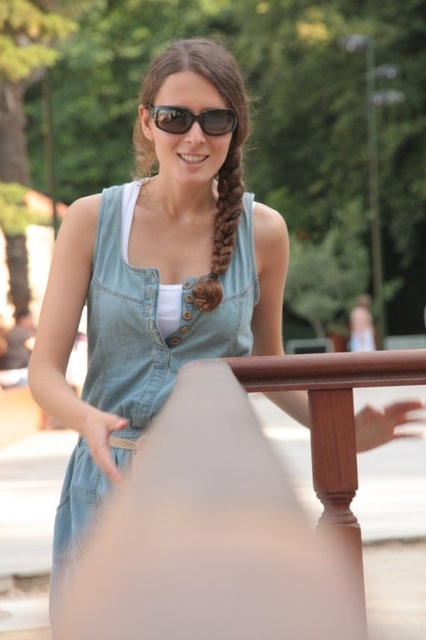
Is point (219, 259) positioned behind point (166, 120)?

Yes, point (219, 259) is farther from viewer.

Does brown silky hair braid at center lie behind matte black sunglasses at center?

Yes, brown silky hair braid at center is further from the viewer.

The width and height of the screenshot is (426, 640). Find the location of `brown silky hair braid at center`. brown silky hair braid at center is located at coordinates (222, 221).

Where is `brown silky hair braid at center`? The height and width of the screenshot is (640, 426). brown silky hair braid at center is located at coordinates (222, 221).

Can you confirm if denim dress at center is thinner than matte denim dress at center?

No, denim dress at center is not thinner than matte denim dress at center.

Is denim dress at center taller than matte denim dress at center?

Yes, denim dress at center is taller than matte denim dress at center.

Who is more forward, (101, 243) or (193, 65)?

Point (193, 65) is in front.

Where is `denim dress at center`? The width and height of the screenshot is (426, 640). denim dress at center is located at coordinates (155, 321).

Does denim dress at center have a lesser height compared to brown silky hair braid at center?

In fact, denim dress at center may be taller than brown silky hair braid at center.

Is denim dress at center positioned at the back of brown silky hair braid at center?

No.

Between point (71, 544) and point (213, 268), which one is positioned behind?

Positioned behind is point (213, 268).

This screenshot has width=426, height=640. Identify the location of denim dress at center. (155, 321).